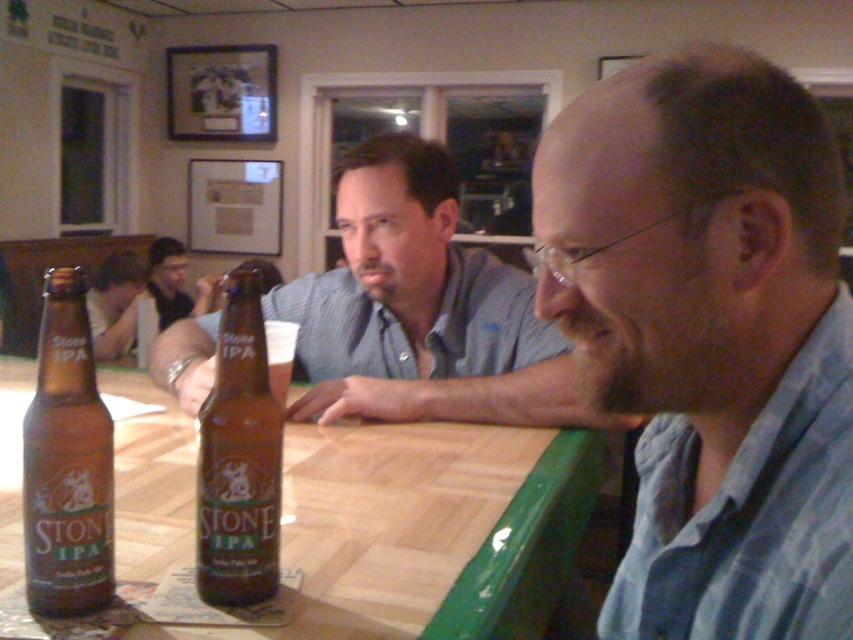
Question: Which point is farther to the camera?

Choices:
 (A) wooden table at center
 (B) smooth skin face at lower left

Answer: (B)

Question: Does wooden table at center have a larger size compared to brown glass bottle at bottle left?

Choices:
 (A) no
 (B) yes

Answer: (B)

Question: Considering the relative positions of matte brown shirt at center and wooden table at center in the image provided, where is matte brown shirt at center located with respect to wooden table at center?

Choices:
 (A) below
 (B) above

Answer: (B)

Question: Which object is closer to the camera taking this photo?

Choices:
 (A) matte black shirt at center
 (B) brown glass bottle at center

Answer: (B)

Question: Is the position of wooden table at center more distant than that of matte glass beer bottle at center?

Choices:
 (A) no
 (B) yes

Answer: (B)

Question: Which point is farther from the camera taking this photo?

Choices:
 (A) (247, 278)
 (B) (96, 604)
 (C) (119, 264)

Answer: (C)